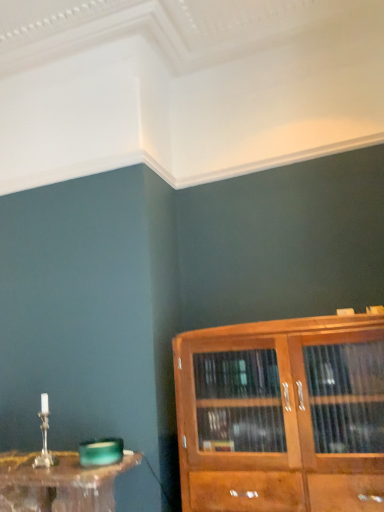
Question: From a real-world perspective, relative to translucent glass table at lower left, is wooden cabinet at right vertically above or below?

Choices:
 (A) below
 (B) above

Answer: (B)

Question: Is wooden cabinet at right in front of or behind translucent glass table at lower left in the image?

Choices:
 (A) behind
 (B) front

Answer: (B)

Question: Which is correct: wooden cabinet at right is inside translucent glass table at lower left, or outside of it?

Choices:
 (A) outside
 (B) inside

Answer: (A)

Question: From the image's perspective, is translucent glass table at lower left located above or below wooden cabinet at right?

Choices:
 (A) above
 (B) below

Answer: (B)

Question: Is translucent glass table at lower left in front of or behind wooden cabinet at right in the image?

Choices:
 (A) behind
 (B) front

Answer: (A)

Question: In terms of width, does translucent glass table at lower left look wider or thinner when compared to wooden cabinet at right?

Choices:
 (A) thin
 (B) wide

Answer: (A)

Question: Is translucent glass table at lower left inside or outside of wooden cabinet at right?

Choices:
 (A) inside
 (B) outside

Answer: (B)